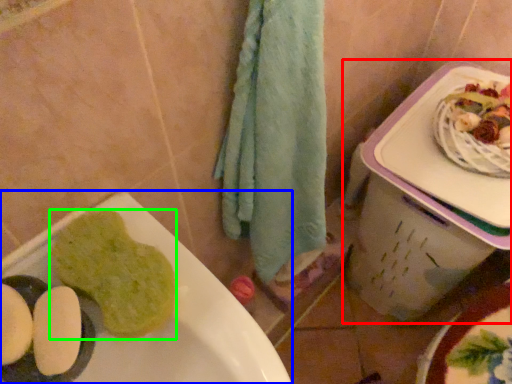
Question: Estimate the real-world distances between objects in this image. Which object is closer to lunch box (highlighted by a red box), sink (highlighted by a blue box) or food (highlighted by a green box)?

Choices:
 (A) sink
 (B) food

Answer: (A)